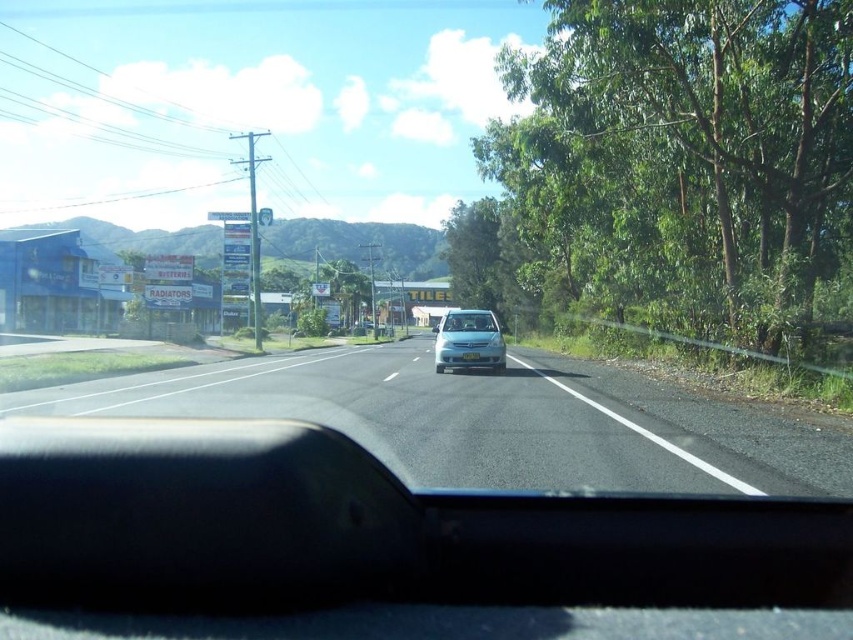
Which is behind, point (602, 1) or point (746, 470)?

Point (602, 1)

In the scene shown: Does green leafy tree at right have a greater width compared to asphalt road at center?

No.

Who is more distant from viewer, (546, 152) or (364, 444)?

Positioned behind is point (546, 152).

Locate an element on the screen. This screenshot has width=853, height=640. green leafy tree at right is located at coordinates (682, 156).

Can you confirm if green leafy tree at right is wider than satin silver sedan at center?

Indeed, green leafy tree at right has a greater width compared to satin silver sedan at center.

Does green leafy tree at right have a greater height compared to satin silver sedan at center?

Correct, green leafy tree at right is much taller as satin silver sedan at center.

Where is `green leafy tree at right`? The image size is (853, 640). green leafy tree at right is located at coordinates (682, 156).

Identify the location of green leafy tree at right. This screenshot has height=640, width=853. (682, 156).

Does asphalt road at center have a greater height compared to clear glass windshield at center?

In fact, asphalt road at center may be shorter than clear glass windshield at center.

Is asphalt road at center in front of clear glass windshield at center?

Yes.

Does point (692, 401) lie behind point (461, 324)?

No, it is in front of (461, 324).

The height and width of the screenshot is (640, 853). Find the location of `asphalt road at center`. asphalt road at center is located at coordinates (490, 420).